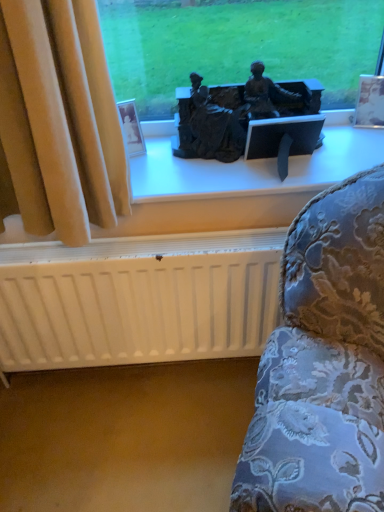
Question: Considering the positions of point (309, 132) and point (26, 333), is point (309, 132) closer or farther from the camera than point (26, 333)?

Choices:
 (A) farther
 (B) closer

Answer: (B)

Question: From the image's perspective, relative to white matte radiator at lower center, is bronze statue at center above or below?

Choices:
 (A) above
 (B) below

Answer: (A)

Question: Estimate the real-world distances between objects in this image. Which object is farther from the bronze statue at center?

Choices:
 (A) white matte radiator at lower center
 (B) matte black statue at center

Answer: (A)

Question: Considering the real-world distances, which object is closest to the bronze statue at center?

Choices:
 (A) white matte radiator at lower center
 (B) matte black statue at center

Answer: (B)